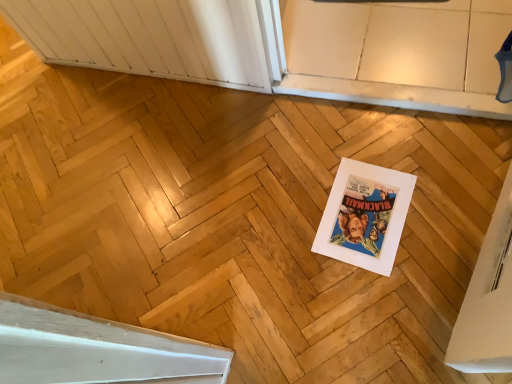
What do you see at coordinates (365, 215) in the screenshot? I see `white paper comic book at center` at bounding box center [365, 215].

At what (x,y) coordinates should I click in order to perform the action: click on white paper comic book at center. Please return your answer as a coordinate pair (x, y). This screenshot has height=384, width=512. Looking at the image, I should click on (365, 215).

You are a GUI agent. You are given a task and a screenshot of the screen. Output one action in this format:
    pyautogui.click(x=<x>, y=<y>)
    Task: Click on the white paper comic book at center
    The height and width of the screenshot is (384, 512).
    Given the screenshot: What is the action you would take?
    pyautogui.click(x=365, y=215)